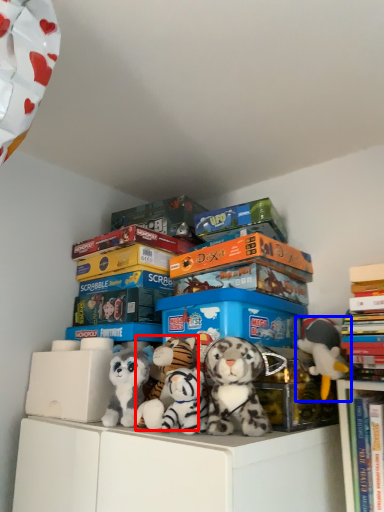
Question: Which object appears closest to the camera in this image, toy (highlighted by a red box) or toy (highlighted by a blue box)?

Choices:
 (A) toy
 (B) toy

Answer: (A)